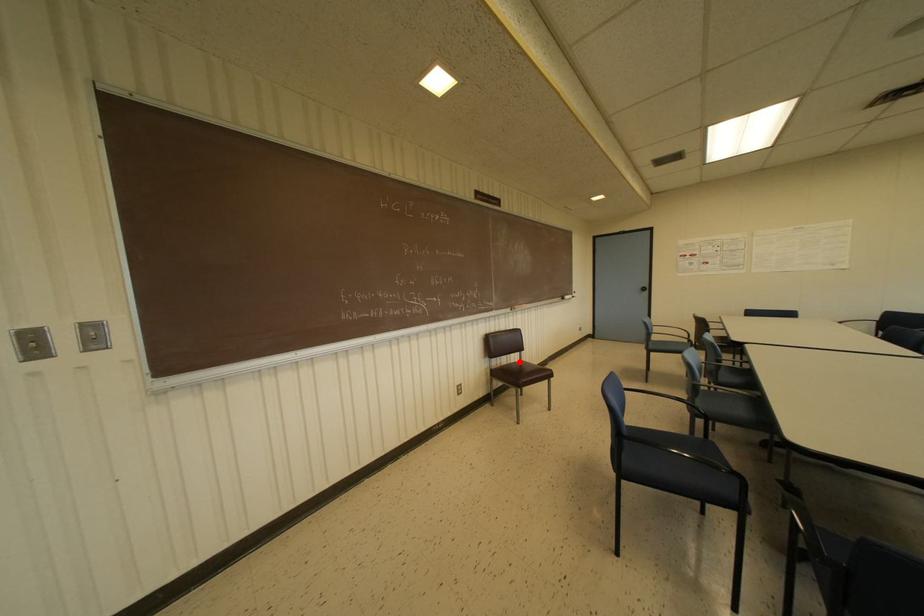
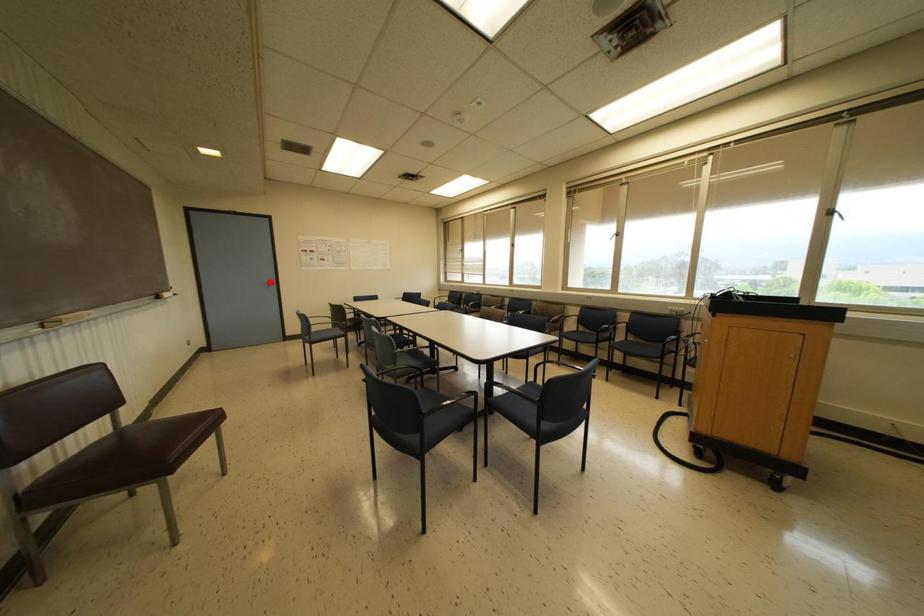
Based on the photo, I am providing you with two images of the same scene from different viewpoints. A red point is marked on the first image and another point is marked on the second image. Is the marked point in image1 the same physical position as the marked point in image2?

No